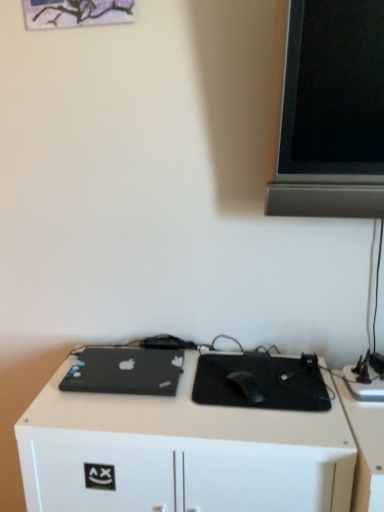
Image resolution: width=384 pixels, height=512 pixels. Find the location of `free space in front of black matte mousepad at center`. free space in front of black matte mousepad at center is located at coordinates [x=270, y=426].